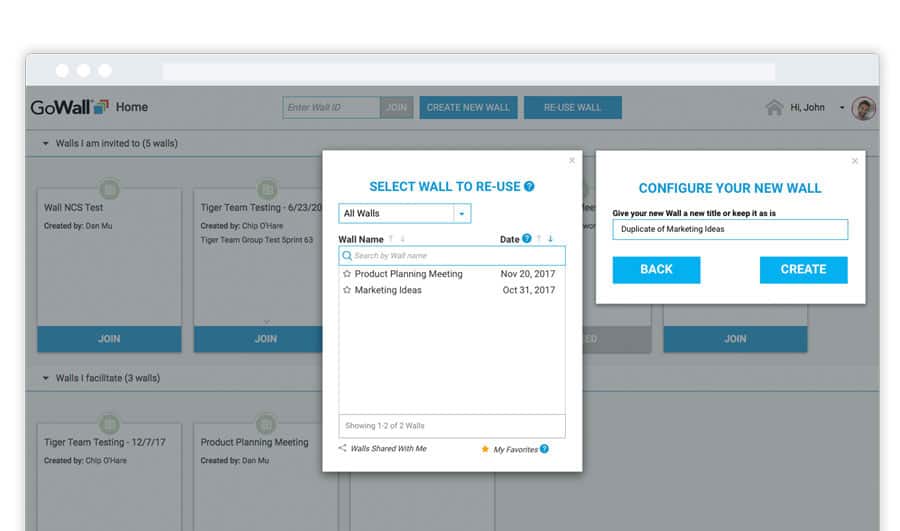
In order to click on re-use wall button in this screenshot , I will do `click(562, 108)`.